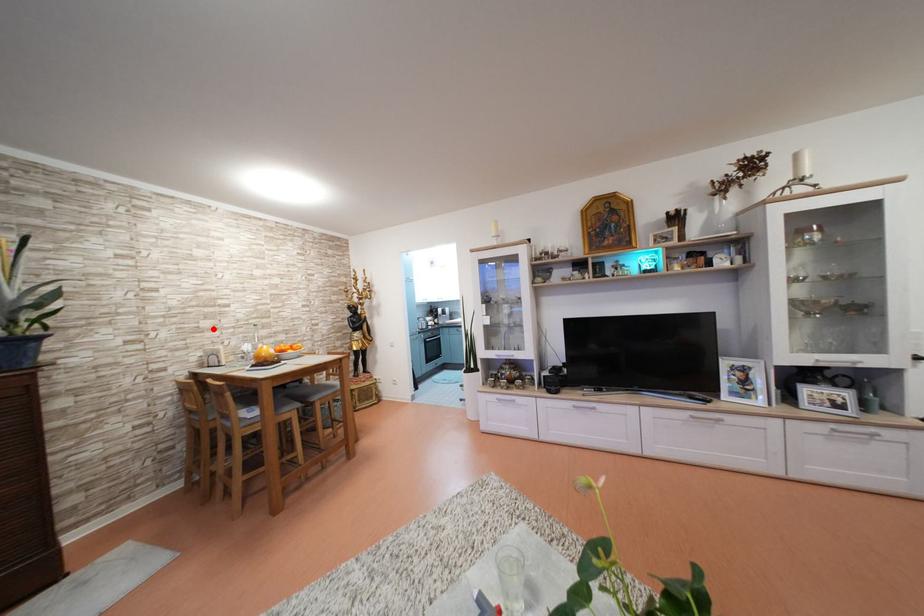
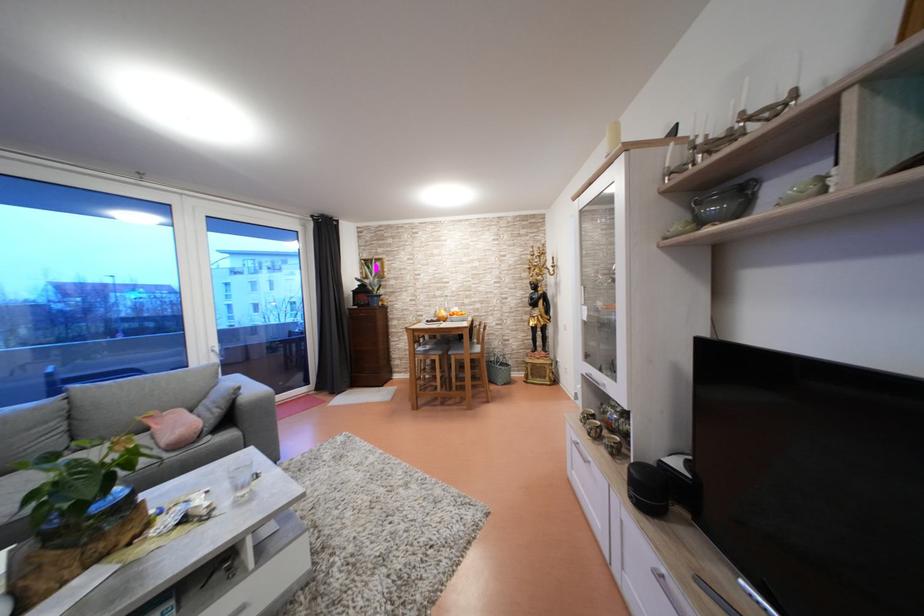
In the second image, find the point that corresponds to the highlighted location in the first image.

(444, 299)